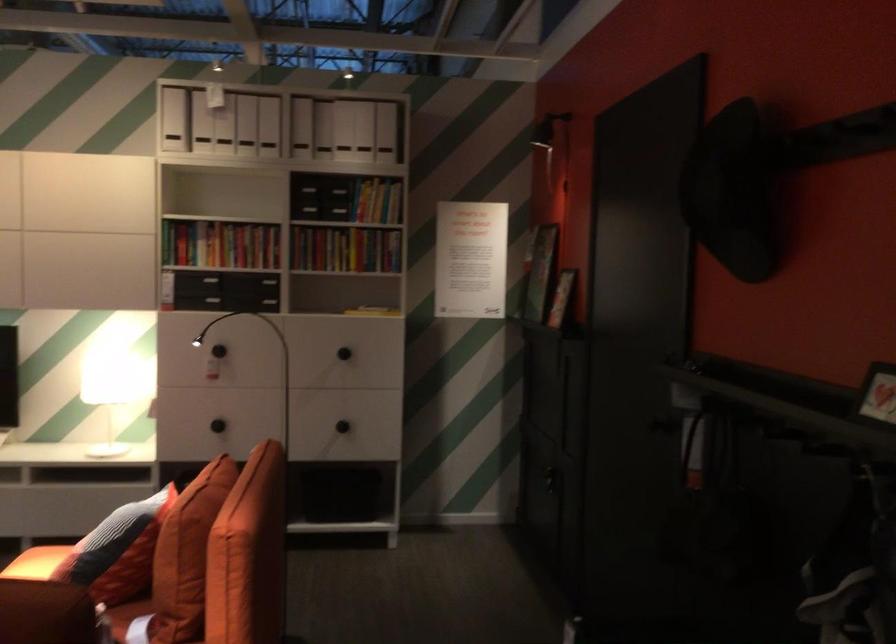
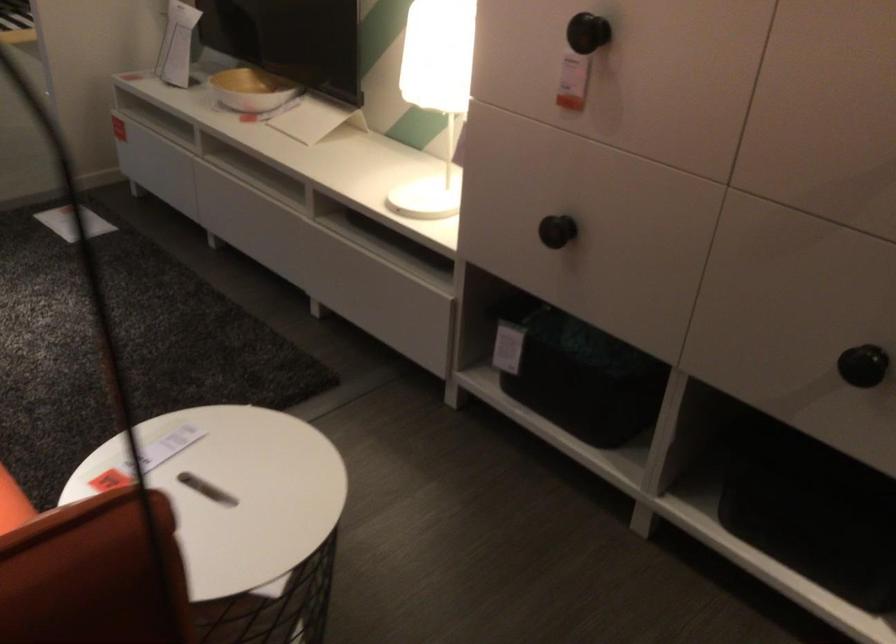
Find the pixel in the second image that matches [216,346] in the first image.

(588, 33)